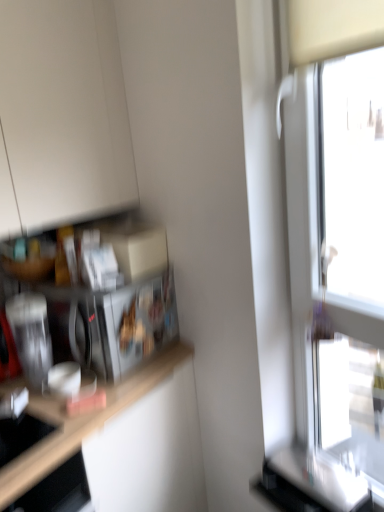
Question: Considering the positions of point (16, 310) and point (319, 484), is point (16, 310) closer or farther from the camera than point (319, 484)?

Choices:
 (A) closer
 (B) farther

Answer: (B)

Question: Considering the positions of brushed metal toaster at left and transparent glass window at right in the image, is brushed metal toaster at left wider or thinner than transparent glass window at right?

Choices:
 (A) thin
 (B) wide

Answer: (A)

Question: Considering the real-world distances, which object is farthest from the brushed metal toaster at left?

Choices:
 (A) metallic silver microwave at left
 (B) transparent glass window at right

Answer: (B)

Question: Which of these objects is positioned closest to the transparent glass window at right?

Choices:
 (A) brushed metal toaster at left
 (B) metallic silver microwave at left

Answer: (B)